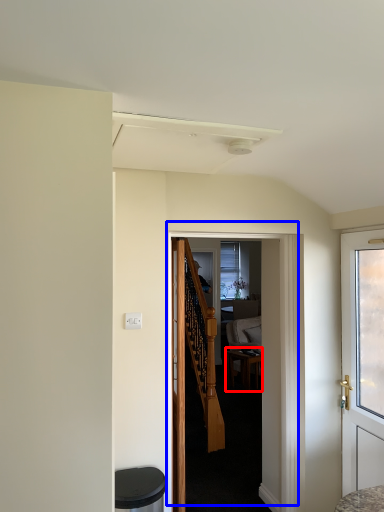
Question: Which object is further to the camera taking this photo, desk (highlighted by a red box) or door (highlighted by a blue box)?

Choices:
 (A) desk
 (B) door

Answer: (A)